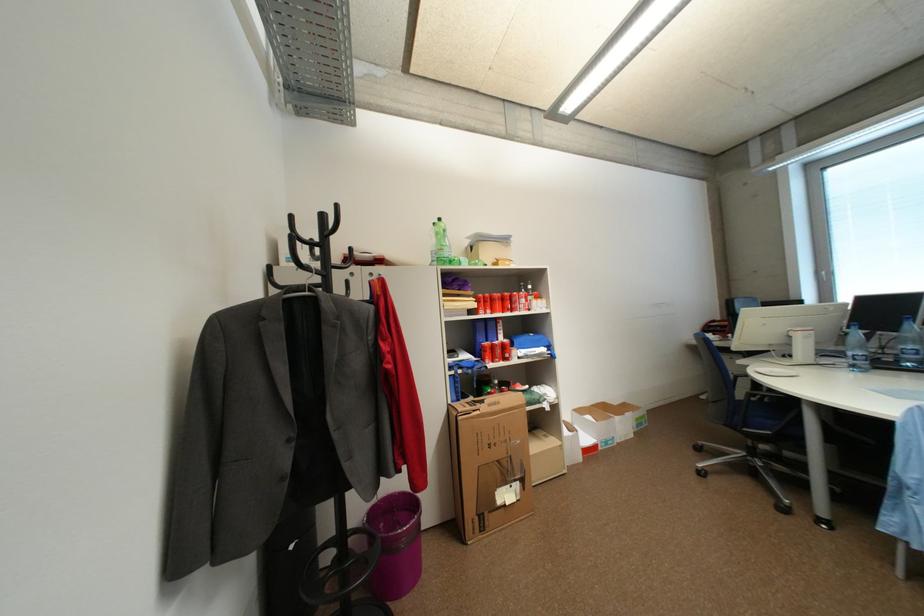
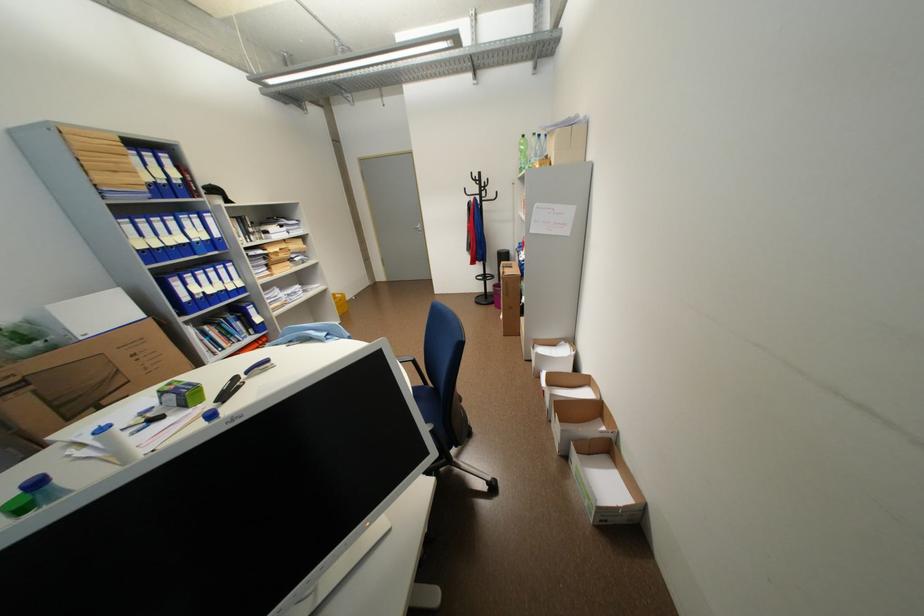
Where in the second image is the point corresponding to the point at 447,220 from the first image?

(531, 137)